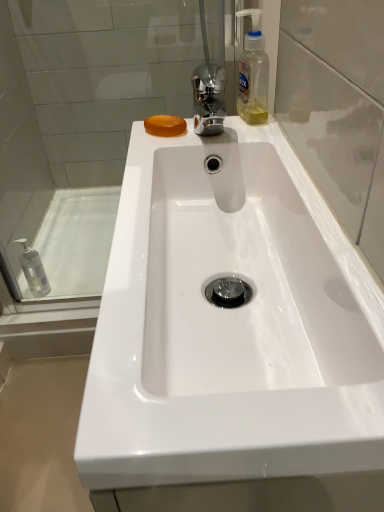
Question: Considering their positions, is transparent glass shower door at upper left located in front of or behind clear plastic bottle at upper right?

Choices:
 (A) behind
 (B) front

Answer: (A)

Question: In terms of size, does transparent glass shower door at upper left appear bigger or smaller than clear plastic bottle at upper right?

Choices:
 (A) small
 (B) big

Answer: (B)

Question: Estimate the real-world distances between objects in this image. Which object is farther from the white glossy bath at left?

Choices:
 (A) clear plastic bottle at upper right
 (B) white glossy sink at center
 (C) transparent glass door at upper right
 (D) clear plastic mouthwash at left
 (E) orange translucent soap at upper left

Answer: (C)

Question: Which object is the farthest from the white glossy sink at center?

Choices:
 (A) clear plastic mouthwash at left
 (B) transparent glass door at upper right
 (C) transparent glass shower door at upper left
 (D) clear plastic bottle at upper right
 (E) white glossy bath at left

Answer: (A)